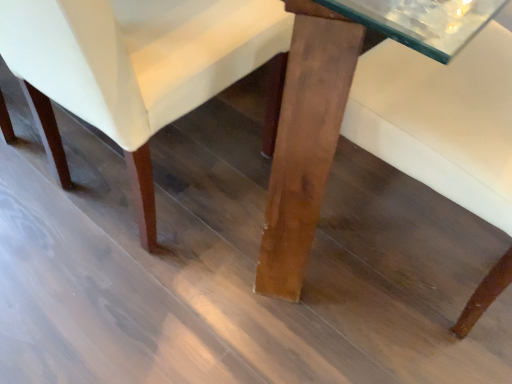
Question: Is wooden table at center to the right of matte wood chair at center from the viewer's perspective?

Choices:
 (A) yes
 (B) no

Answer: (A)

Question: From a real-world perspective, is wooden table at center physically above matte wood chair at center?

Choices:
 (A) yes
 (B) no

Answer: (B)

Question: Does wooden table at center have a smaller size compared to matte wood chair at center?

Choices:
 (A) no
 (B) yes

Answer: (B)

Question: Does wooden table at center have a larger size compared to matte wood chair at center?

Choices:
 (A) no
 (B) yes

Answer: (A)

Question: Is wooden table at center positioned with its back to matte wood chair at center?

Choices:
 (A) no
 (B) yes

Answer: (A)

Question: Can we say wooden table at center lies outside matte wood chair at center?

Choices:
 (A) no
 (B) yes

Answer: (B)

Question: From a real-world perspective, is matte wood chair at center physically below wooden table at center?

Choices:
 (A) no
 (B) yes

Answer: (A)

Question: Is matte wood chair at center oriented towards wooden table at center?

Choices:
 (A) yes
 (B) no

Answer: (B)

Question: Is matte wood chair at center surrounding wooden table at center?

Choices:
 (A) no
 (B) yes

Answer: (A)

Question: Does matte wood chair at center have a greater height compared to wooden table at center?

Choices:
 (A) yes
 (B) no

Answer: (A)

Question: From the image's perspective, is matte wood chair at center over wooden table at center?

Choices:
 (A) yes
 (B) no

Answer: (A)

Question: Can we say matte wood chair at center lies outside wooden table at center?

Choices:
 (A) yes
 (B) no

Answer: (A)

Question: From their relative heights in the image, would you say wooden table at center is taller or shorter than matte wood chair at center?

Choices:
 (A) tall
 (B) short

Answer: (B)